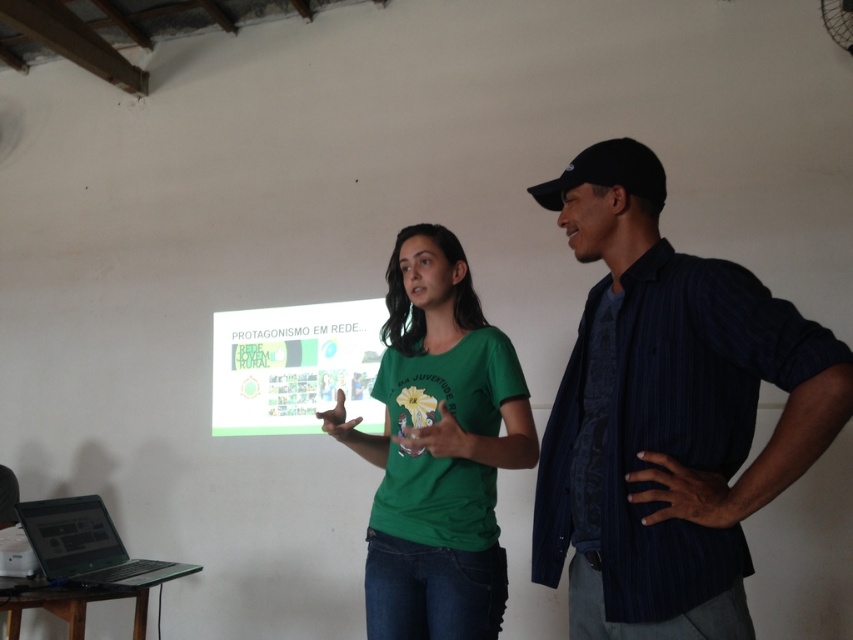
You are standing in the room where the presentation is happening. You need to place a small sticker exactly at the point with coordinates (437, 449). Which object should you place it on?

The point with coordinates (437, 449) is located on the green matte t shirt at center. Therefore, you should place the sticker on the green matte t shirt at center.